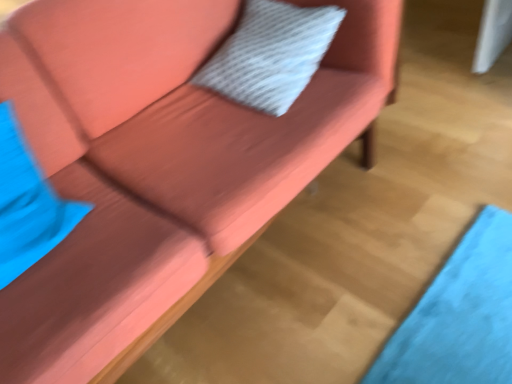
Question: From the image's perspective, is blue fabric pillow at left, placed as the second pillow when sorted from top to bottom, below white textured pillow at center, positioned as the second pillow in bottom-to-top order?

Choices:
 (A) yes
 (B) no

Answer: (A)

Question: Does blue fabric pillow at left, which ranks as the first pillow in left-to-right order, appear on the right side of white textured pillow at center, positioned as the second pillow in bottom-to-top order?

Choices:
 (A) yes
 (B) no

Answer: (B)

Question: Is blue fabric pillow at left, which is the 1th pillow from front to back, oriented away from white textured pillow at center, the 1th pillow in the right-to-left sequence?

Choices:
 (A) yes
 (B) no

Answer: (B)

Question: Does blue fabric pillow at left, which is the 1th pillow from front to back, come in front of white textured pillow at center, the 1th pillow in the right-to-left sequence?

Choices:
 (A) yes
 (B) no

Answer: (A)

Question: Can you confirm if blue fabric pillow at left, the 2th pillow from the back, is smaller than white textured pillow at center, which is the second pillow in left-to-right order?

Choices:
 (A) yes
 (B) no

Answer: (A)

Question: Is blue fabric pillow at left, which ranks as the first pillow in left-to-right order, at the left side of white textured pillow at center, which is the second pillow in left-to-right order?

Choices:
 (A) no
 (B) yes

Answer: (B)

Question: Considering the relative sizes of white textured pillow at center, the 1th pillow in the right-to-left sequence, and blue fabric pillow at left, which is the 1th pillow from front to back, in the image provided, is white textured pillow at center, the 1th pillow in the right-to-left sequence, wider than blue fabric pillow at left, which is the 1th pillow from front to back,?

Choices:
 (A) yes
 (B) no

Answer: (A)

Question: Does white textured pillow at center, the 1th pillow in the right-to-left sequence, lie behind blue fabric pillow at left, the 2th pillow from the right?

Choices:
 (A) no
 (B) yes

Answer: (B)

Question: Considering the relative positions of white textured pillow at center, which is counted as the first pillow, starting from the top, and blue fabric pillow at left, which ranks as the first pillow in left-to-right order, in the image provided, is white textured pillow at center, which is counted as the first pillow, starting from the top, to the right of blue fabric pillow at left, which ranks as the first pillow in left-to-right order, from the viewer's perspective?

Choices:
 (A) no
 (B) yes

Answer: (B)

Question: From the image's perspective, is white textured pillow at center, which is the second pillow in left-to-right order, under blue fabric pillow at left, the 2th pillow from the back?

Choices:
 (A) yes
 (B) no

Answer: (B)

Question: Could you tell me if white textured pillow at center, which is counted as the first pillow, starting from the top, is facing blue fabric pillow at left, which ranks as the first pillow in left-to-right order?

Choices:
 (A) no
 (B) yes

Answer: (B)

Question: From a real-world perspective, is white textured pillow at center, the 1th pillow in the right-to-left sequence, positioned over blue fabric pillow at left, which ranks as the first pillow in left-to-right order, based on gravity?

Choices:
 (A) no
 (B) yes

Answer: (A)

Question: Considering the relative positions of white textured pillow at center, positioned as the second pillow in bottom-to-top order, and blue fabric pillow at left, placed as the second pillow when sorted from top to bottom, in the image provided, is white textured pillow at center, positioned as the second pillow in bottom-to-top order, to the left or to the right of blue fabric pillow at left, placed as the second pillow when sorted from top to bottom,?

Choices:
 (A) right
 (B) left

Answer: (A)